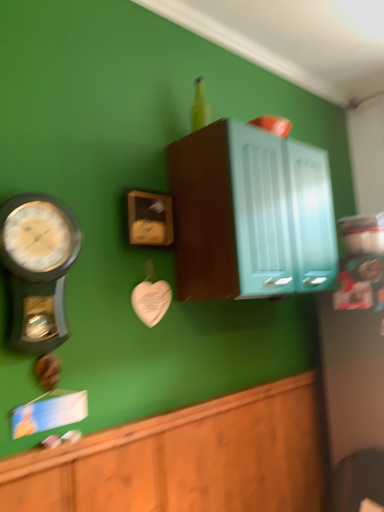
Question: Is wooden cabinet at lower center, which ranks as the 2th cabinetry in top-to-bottom order, completely or partially outside of wooden clock at center?

Choices:
 (A) no
 (B) yes

Answer: (B)

Question: Is wooden clock at center at the back of wooden cabinet at lower center, positioned as the first cabinetry in bottom-to-top order?

Choices:
 (A) yes
 (B) no

Answer: (B)

Question: From the image's perspective, does wooden cabinet at lower center, positioned as the first cabinetry in bottom-to-top order, appear lower than wooden clock at center?

Choices:
 (A) yes
 (B) no

Answer: (A)

Question: Can you confirm if wooden cabinet at lower center, positioned as the first cabinetry in bottom-to-top order, is bigger than wooden clock at center?

Choices:
 (A) yes
 (B) no

Answer: (A)

Question: Are wooden cabinet at lower center, positioned as the first cabinetry in bottom-to-top order, and wooden clock at center beside each other?

Choices:
 (A) yes
 (B) no

Answer: (B)

Question: From the image's perspective, is wooden clock at center above or below wooden cabinet at lower center, which ranks as the 2th cabinetry in top-to-bottom order?

Choices:
 (A) above
 (B) below

Answer: (A)

Question: Do you think wooden clock at center is within wooden cabinet at lower center, which ranks as the 2th cabinetry in top-to-bottom order, or outside of it?

Choices:
 (A) inside
 (B) outside

Answer: (B)

Question: Looking at their shapes, would you say wooden clock at center is wider or thinner than wooden cabinet at lower center, which ranks as the 2th cabinetry in top-to-bottom order?

Choices:
 (A) thin
 (B) wide

Answer: (A)

Question: From a real-world perspective, is wooden clock at center positioned above or below wooden cabinet at lower center, positioned as the first cabinetry in bottom-to-top order?

Choices:
 (A) below
 (B) above

Answer: (B)

Question: From the image's perspective, is teal glossy cabinet at upper center, marked as the 1th cabinetry in a top-to-bottom arrangement, located above or below wooden cabinet at lower center, which ranks as the 2th cabinetry in top-to-bottom order?

Choices:
 (A) above
 (B) below

Answer: (A)

Question: Considering the positions of point (223, 158) and point (155, 477), is point (223, 158) closer or farther from the camera than point (155, 477)?

Choices:
 (A) closer
 (B) farther

Answer: (B)

Question: Relative to wooden cabinet at lower center, which ranks as the 2th cabinetry in top-to-bottom order, is teal glossy cabinet at upper center, marked as the 1th cabinetry in a top-to-bottom arrangement, in front or behind?

Choices:
 (A) behind
 (B) front

Answer: (A)

Question: Would you say teal glossy cabinet at upper center, marked as the 1th cabinetry in a top-to-bottom arrangement, is inside or outside wooden cabinet at lower center, positioned as the first cabinetry in bottom-to-top order?

Choices:
 (A) inside
 (B) outside

Answer: (B)

Question: From a real-world perspective, is teal glossy cabinet at upper center, marked as the 1th cabinetry in a top-to-bottom arrangement, above or below wooden clock at center?

Choices:
 (A) above
 (B) below

Answer: (A)

Question: Considering the positions of teal glossy cabinet at upper center, marked as the 1th cabinetry in a top-to-bottom arrangement, and wooden clock at center in the image, is teal glossy cabinet at upper center, marked as the 1th cabinetry in a top-to-bottom arrangement, taller or shorter than wooden clock at center?

Choices:
 (A) short
 (B) tall

Answer: (B)